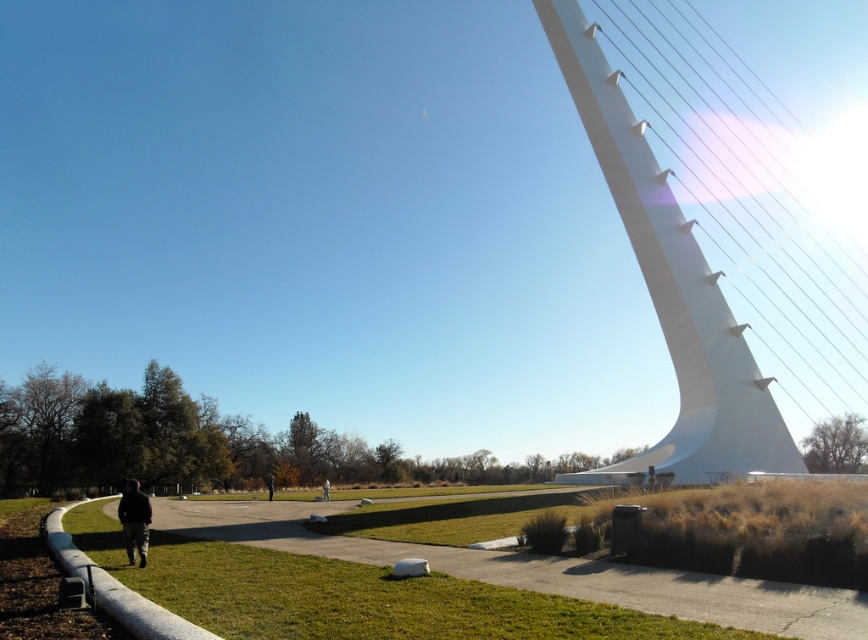
You are planning to cross the white smooth suspension bridge at right while carrying a large backpack. The gray fabric person at center is standing on the bridge. Do you think the bridge can support both of you?

The white smooth suspension bridge at right might be wider than gray fabric person at center, but the description does not provide information about the bridge capacity or weight limits. It is uncertain if the bridge can safely support both of you. Check for any posted signs or consult the structure specifications before proceeding.

You are standing on the paved pathway and see the black fabric person at lower center and the gray fabric person at center. Which person is positioned to the left when facing the structure?

The black fabric person at lower center is to the left of the gray fabric person at center when facing the structure.